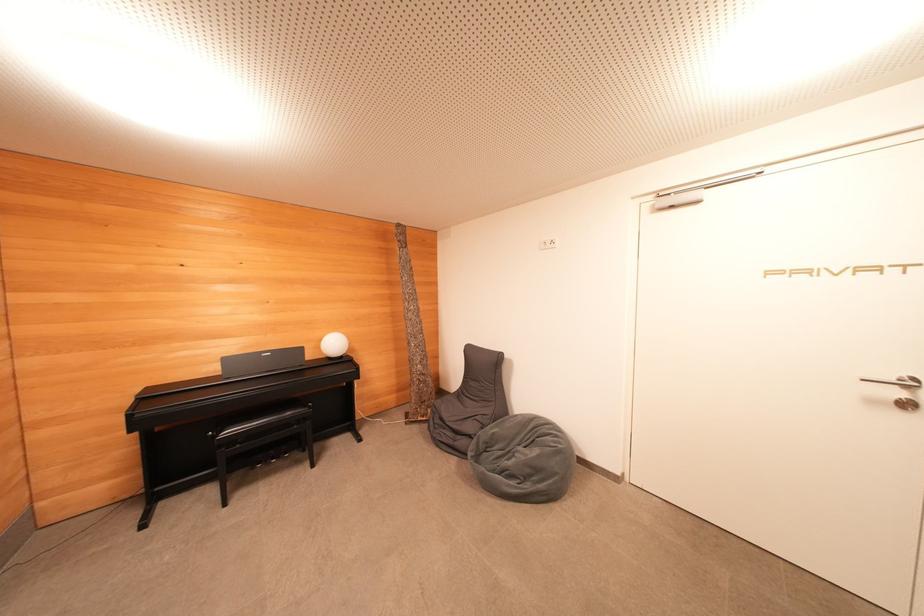
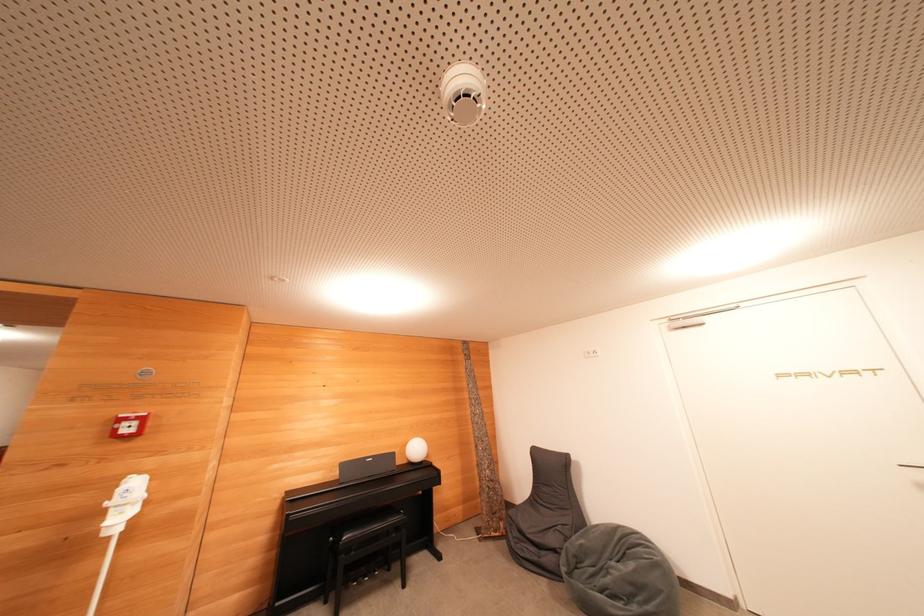
Locate, in the second image, the point that corresponds to pixel 337 347 in the first image.

(419, 453)